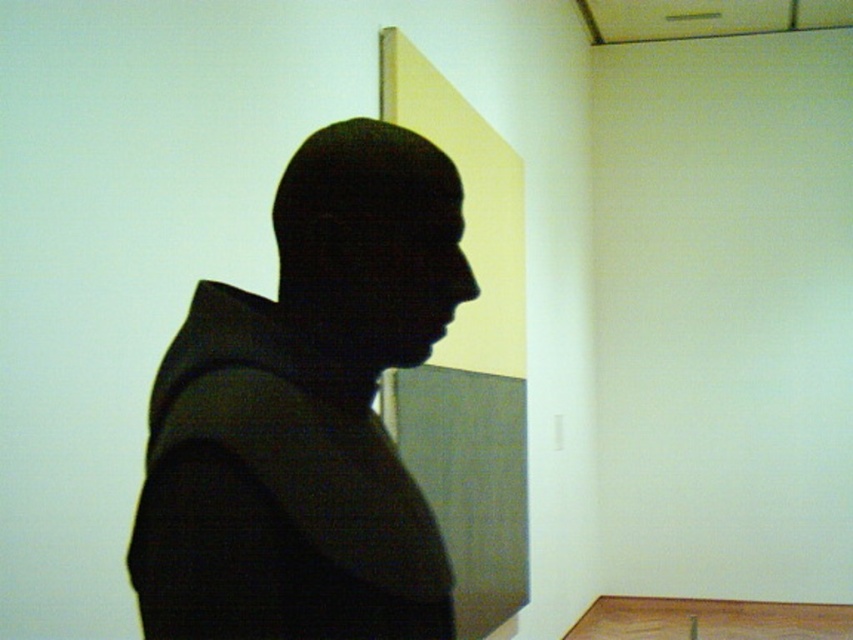
Question: Which of the following is the closest to the observer?

Choices:
 (A) (463, 262)
 (B) (328, 177)

Answer: (B)

Question: Among these points, which one is farthest from the camera?

Choices:
 (A) (302, 467)
 (B) (325, 182)

Answer: (B)

Question: Does black matte bust at center appear under black matte head at center?

Choices:
 (A) no
 (B) yes

Answer: (B)

Question: Among these objects, which one is nearest to the camera?

Choices:
 (A) black matte head at center
 (B) black matte bust at center

Answer: (B)

Question: Is black matte bust at center wider than black matte head at center?

Choices:
 (A) no
 (B) yes

Answer: (B)

Question: Is black matte bust at center smaller than black matte head at center?

Choices:
 (A) yes
 (B) no

Answer: (B)